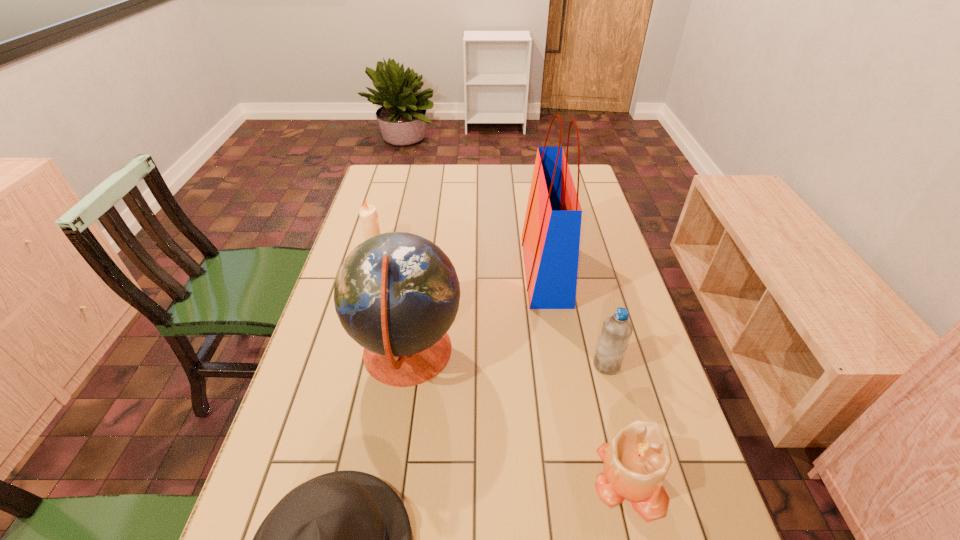
What are the coordinates of `free space that satisfies the following two spatial constraints: 1. on the front side of the farther candle; 2. on the right side of the nearer candle` in the screenshot? It's located at (306, 480).

I want to click on blank space that satisfies the following two spatial constraints: 1. with the Americas facing the viewer on the second tallest object; 2. on the left side of the water bottle, so click(x=405, y=365).